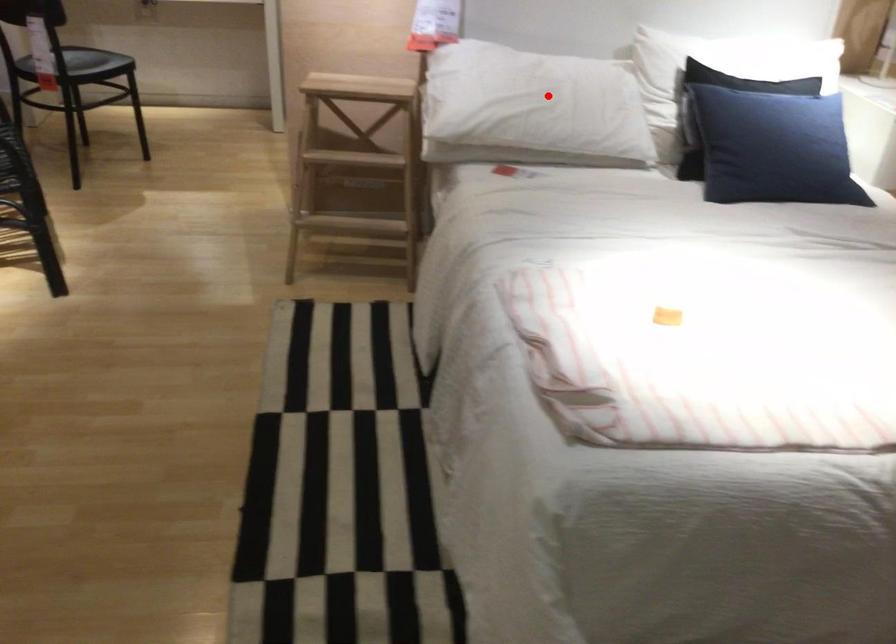
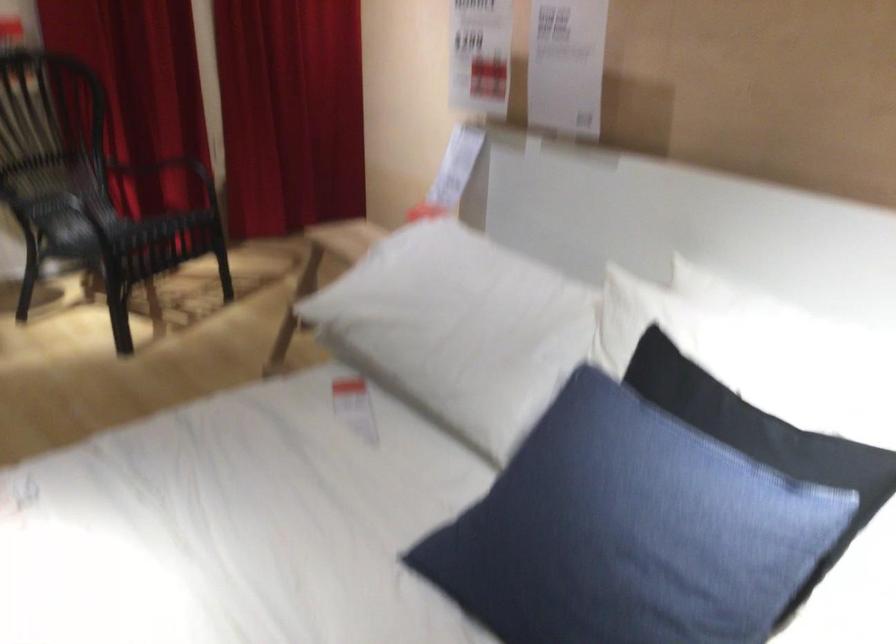
Where in the second image is the point corresponding to the highlighted location from the first image?

(455, 321)